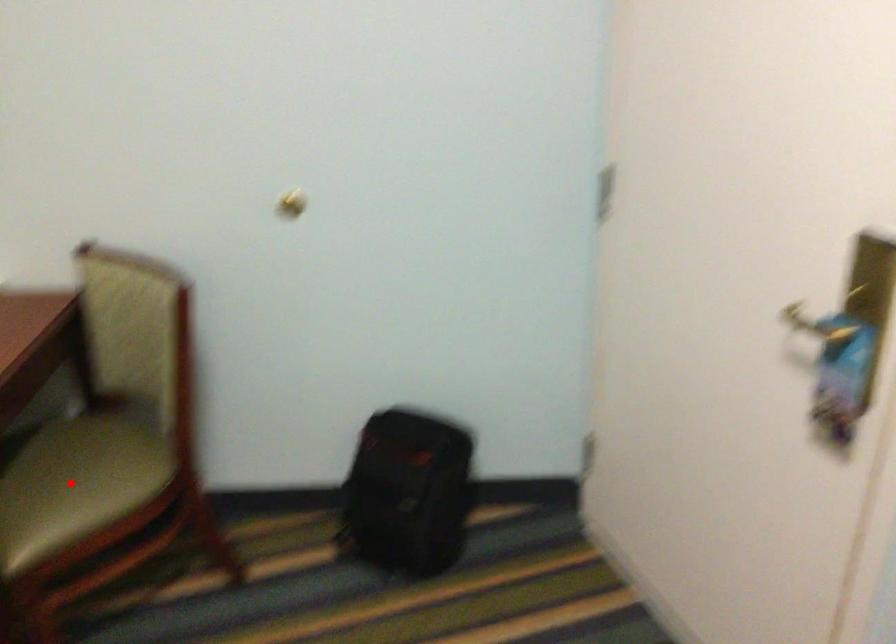
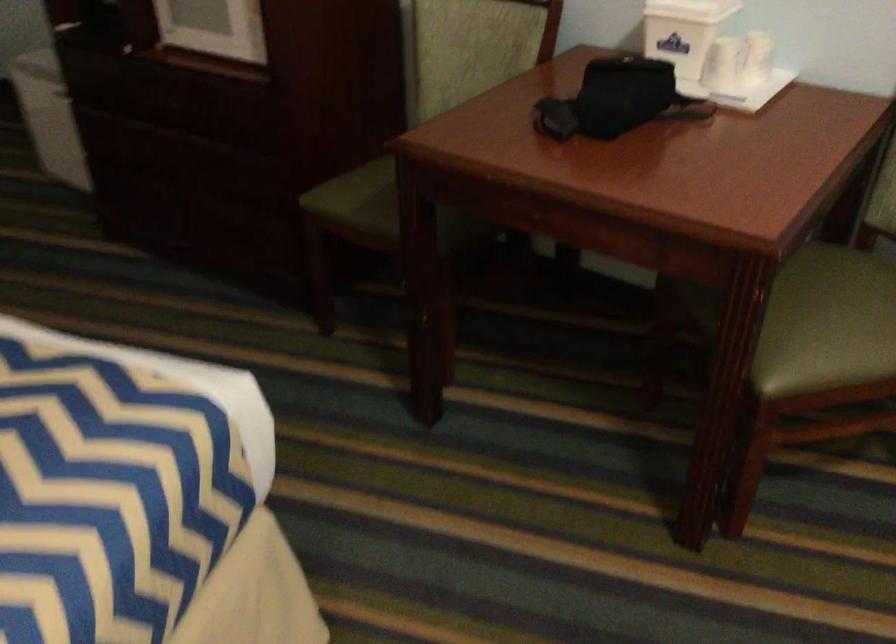
Question: I am providing you with two images of the same scene from different viewpoints. Image1 has a red point marked. In image2, the corresponding 3D location appears at what relative position? Reply with the corresponding letter.

Choices:
 (A) Closer
 (B) Farther

Answer: (A)